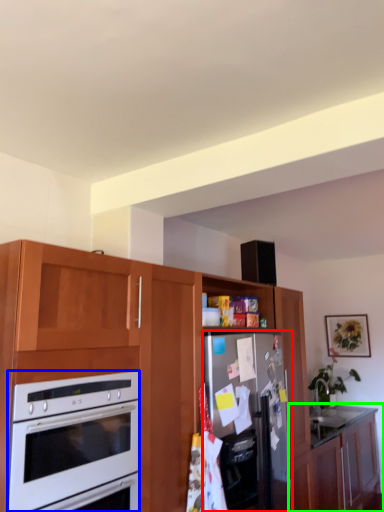
Question: Which object is the farthest from refrigerator (highlighted by a red box)? Choose among these: oven (highlighted by a blue box) or cabinetry (highlighted by a green box).

Choices:
 (A) oven
 (B) cabinetry

Answer: (B)